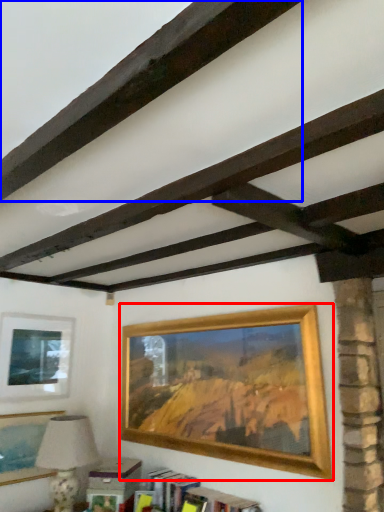
Question: Which of the following is the farthest to the observer, picture frame (highlighted by a red box) or plank (highlighted by a blue box)?

Choices:
 (A) picture frame
 (B) plank

Answer: (A)